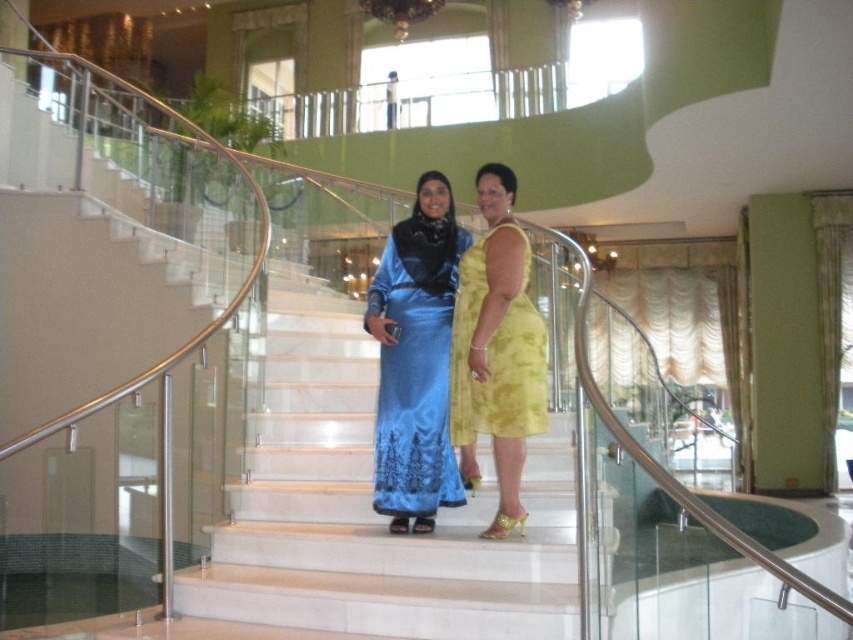
Does satin blue dress at center appear over yellow satin dress at center?

No.

Is point (399, 260) closer to camera compared to point (527, 419)?

No, it is behind (527, 419).

What do you see at coordinates (412, 397) in the screenshot? I see `satin blue dress at center` at bounding box center [412, 397].

At what (x,y) coordinates should I click in order to perform the action: click on satin blue dress at center. Please return your answer as a coordinate pair (x, y). This screenshot has height=640, width=853. Looking at the image, I should click on (412, 397).

Is white marble stairs at center smaller than yellow satin dress at center?

Actually, white marble stairs at center might be larger than yellow satin dress at center.

Looking at this image, which is above, white marble stairs at center or yellow satin dress at center?

yellow satin dress at center is above.

Which is behind, point (77, 337) or point (531, 301)?

The point (77, 337) is behind.

This screenshot has height=640, width=853. I want to click on white marble stairs at center, so click(x=221, y=412).

Can you confirm if white marble stairs at center is positioned to the left of satin blue dress at center?

Correct, you'll find white marble stairs at center to the left of satin blue dress at center.

Is white marble stairs at center bigger than satin blue dress at center?

Indeed, white marble stairs at center has a larger size compared to satin blue dress at center.

Who is more distant from viewer, (312, 177) or (430, 369)?

The point (312, 177) is behind.

The image size is (853, 640). I want to click on white marble stairs at center, so click(221, 412).